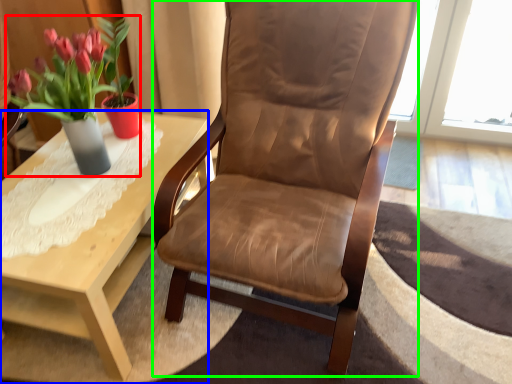
Question: Estimate the real-world distances between objects in this image. Which object is closer to houseplant (highlighted by a red box), coffee table (highlighted by a blue box) or chair (highlighted by a green box)?

Choices:
 (A) coffee table
 (B) chair

Answer: (A)